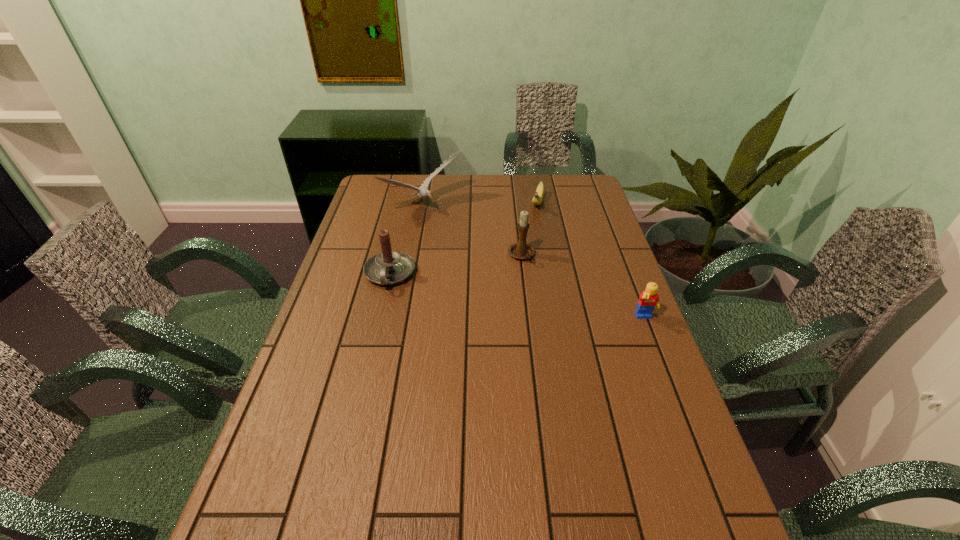
Identify which object is located as the nearest to the nearest object. Please provide its 2D coordinates. Your answer should be formatted as a tuple, i.e. [(x, y)], where the tuple contains the x and y coordinates of a point satisfying the conditions above.

[(521, 250)]

Locate which object is the third closest to the third object from left to right. Please provide its 2D coordinates. Your answer should be formatted as a tuple, i.e. [(x, y)], where the tuple contains the x and y coordinates of a point satisfying the conditions above.

[(389, 267)]

Identify the location of vacant region that satisfies the following two spatial constraints: 1. on the front side of the third object from left to right; 2. on the right side of the gull. (416, 255).